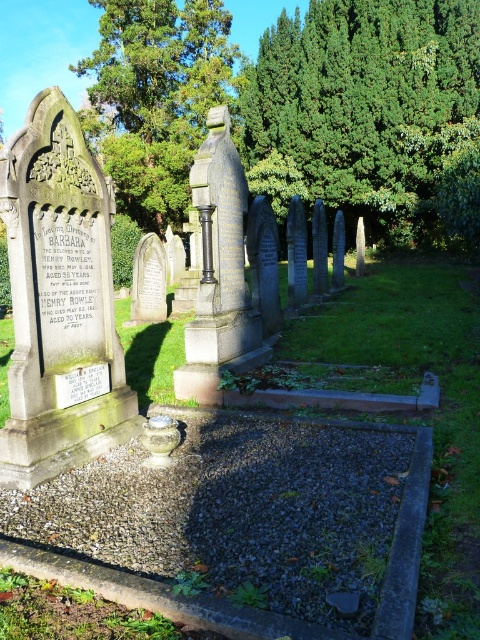
You are a landscape architect designing a new garden layout. You need to place a new bench between the green leafy tree at upper center and the green leafy tree at upper left. Which tree should the bench be closer to if you want it to be closer to the smaller tree?

The bench should be closer to the green leafy tree at upper center because it is the smaller tree compared to the green leafy tree at upper left.

You are a gardener planning to trim the trees in the cemetery. You need to determine which tree requires a taller ladder. Based on the image, which tree between the green leafy tree at upper center and the green leafy tree at upper left should you use a taller ladder for?

The green leafy tree at upper left requires a taller ladder because it has a greater height compared to the green leafy tree at upper center.

You are standing in the cemetery looking at the gravestone of Barbara and Henry Rowley. You notice two green leafy trees in the background. Which tree is closer to you, the green leafy tree at upper center or the green leafy tree at upper left?

The green leafy tree at upper center is closer to you because it is in front of the green leafy tree at upper left.